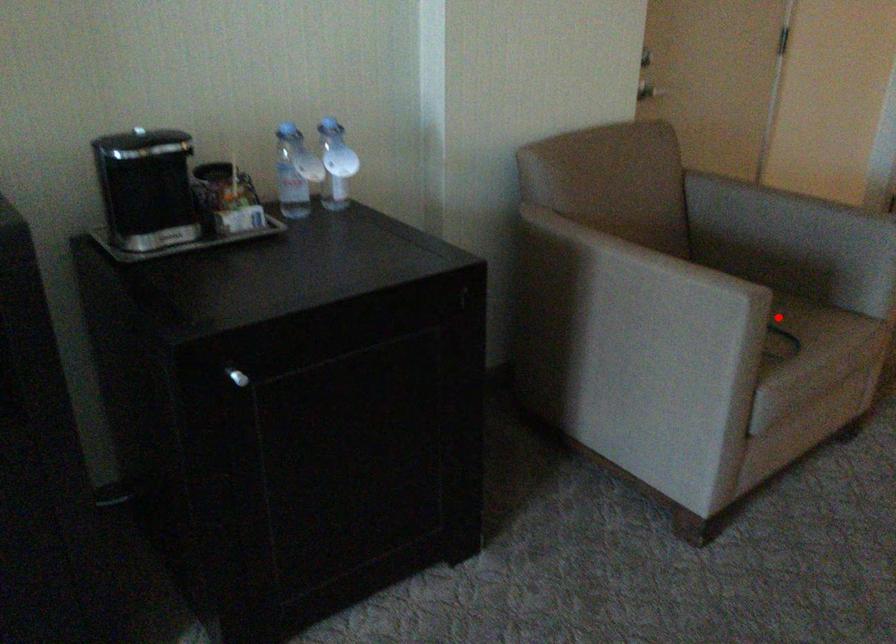
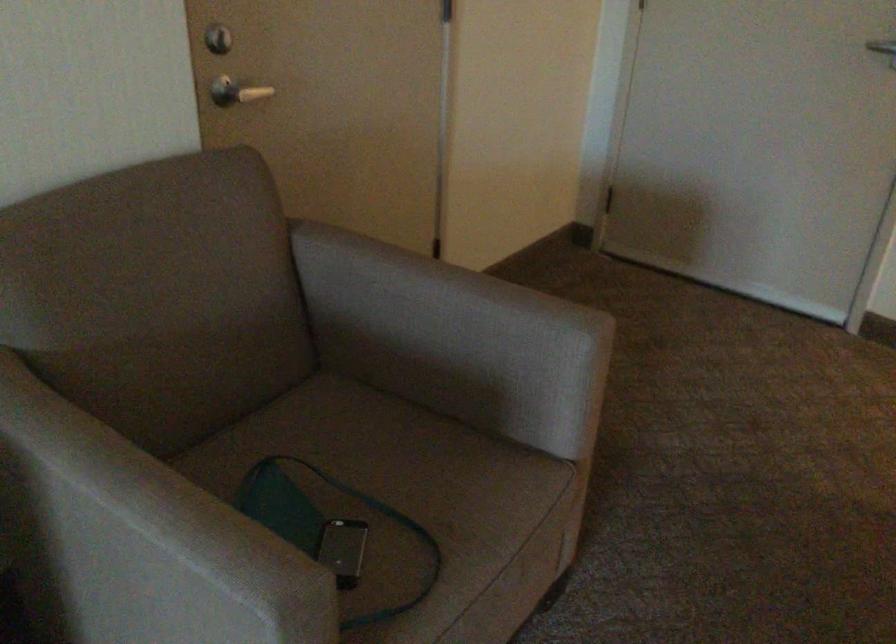
Locate, in the second image, the point that corresponds to the highlighted location in the first image.

(412, 505)